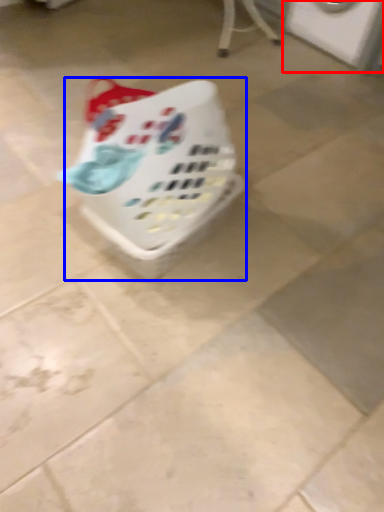
Question: Among these objects, which one is farthest to the camera, washing machine (highlighted by a red box) or basket (highlighted by a blue box)?

Choices:
 (A) washing machine
 (B) basket

Answer: (A)